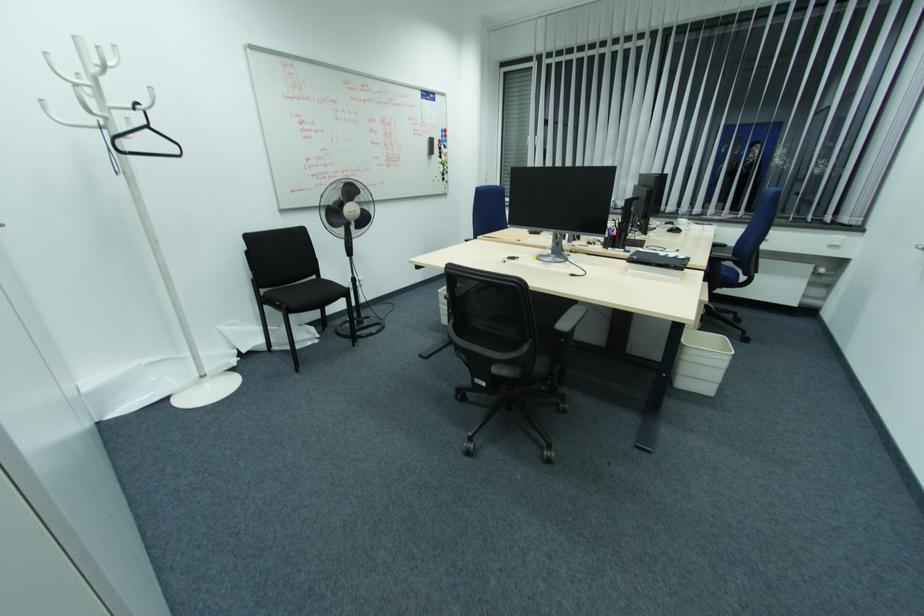
Where would you attach the colorful round magnet? Please return your answer as a coordinate pair (x, y).

(442, 138)